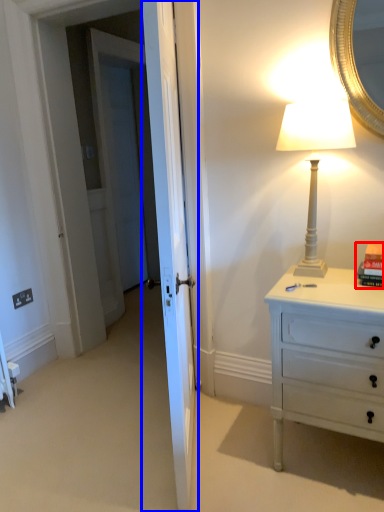
Question: Which point is closer to the camera, book (highlighted by a red box) or door (highlighted by a blue box)?

Choices:
 (A) book
 (B) door

Answer: (B)